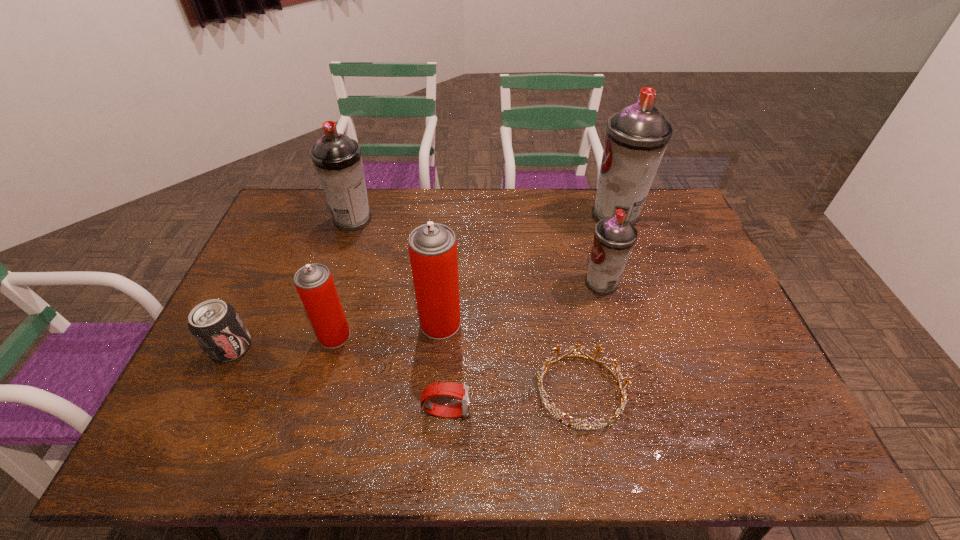
Where is `free region located 0.400m on the front-facing side of the tiara`? free region located 0.400m on the front-facing side of the tiara is located at coordinates (373, 390).

I want to click on vacant space located 0.240m on the front-facing side of the tiara, so click(x=439, y=390).

This screenshot has height=540, width=960. I want to click on vacant point located 0.210m on the front-facing side of the tiara, so click(x=450, y=390).

Locate an element on the screen. The height and width of the screenshot is (540, 960). watch located in the near edge section of the desktop is located at coordinates (460, 391).

Identify the location of tiara that is at the near edge. (540, 379).

Locate an element on the screen. The height and width of the screenshot is (540, 960). object at the left edge is located at coordinates (216, 326).

Find the location of a particular element. This screenshot has width=960, height=540. object that is at the right edge is located at coordinates (636, 138).

Identify the location of object situated at the far right corner. (636, 138).

Identify the location of vacant region at the far edge of the desktop. The image size is (960, 540). (524, 203).

You are a GUI agent. You are given a task and a screenshot of the screen. Output one action in this format:
    pyautogui.click(x=<x>, y=<y>)
    Task: Click on the free location at the near edge of the desktop
    
    Given the screenshot: What is the action you would take?
    pyautogui.click(x=656, y=450)